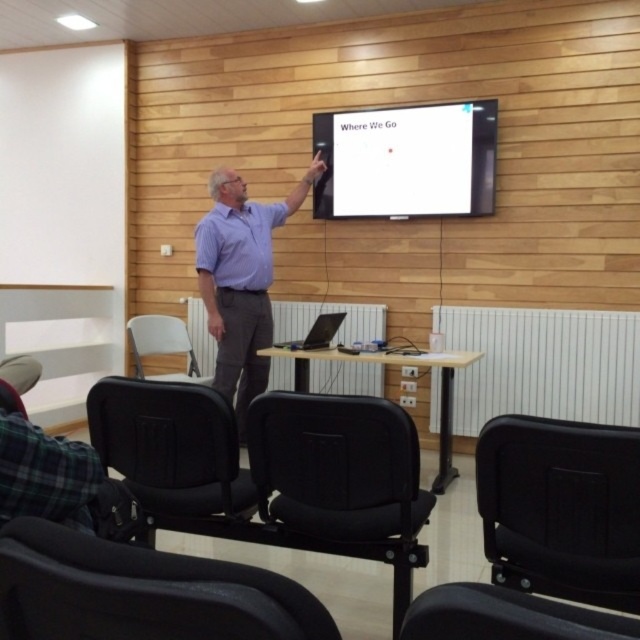
You are attending a presentation and notice the matte purple shirt at center and the black leather armchair at lower right. Which object takes up more visual space in the image?

The matte purple shirt at center takes up more visual space in the image as it has a larger size compared to the black leather armchair at lower right.